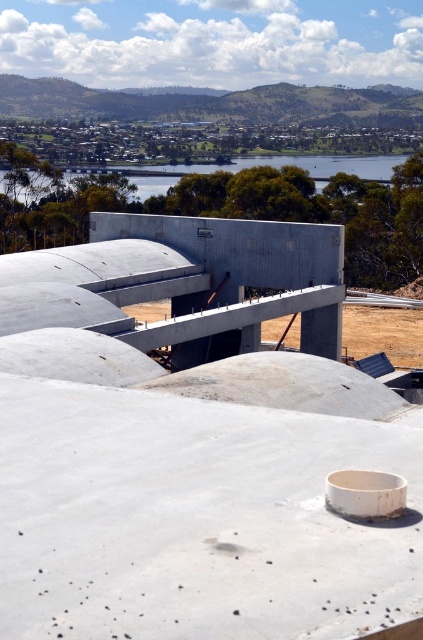
Question: Can you confirm if white smooth concrete at center is smaller than blue water at center?

Choices:
 (A) yes
 (B) no

Answer: (A)

Question: Which of the following is the closest to the observer?

Choices:
 (A) white smooth concrete at center
 (B) blue water at center

Answer: (A)

Question: Among these points, which one is nearest to the camera?

Choices:
 (A) (148, 483)
 (B) (334, 157)

Answer: (A)

Question: Does white smooth concrete at center appear under blue water at center?

Choices:
 (A) no
 (B) yes

Answer: (B)

Question: Does white smooth concrete at center have a lesser width compared to blue water at center?

Choices:
 (A) no
 (B) yes

Answer: (B)

Question: Which point is farther from the camera taking this photo?

Choices:
 (A) (376, 157)
 (B) (87, 506)

Answer: (A)